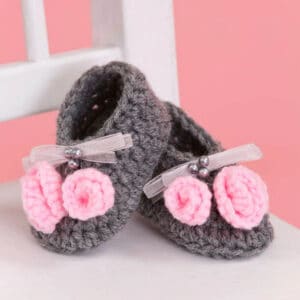
At what (x,y) coordinates should I click in order to perform the action: click on white chair back. Please return your answer as a coordinate pair (x, y). Looking at the image, I should click on (15, 95).